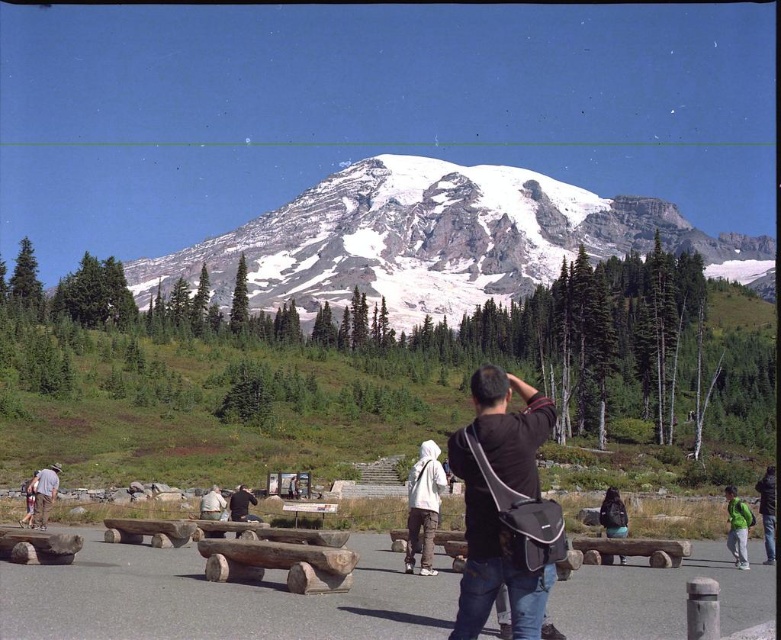
You are planning to borrow a jacket from either the green fabric jacket at lower right or the denim jacket at lower left. Which jacket should you choose if you want the wider one?

The green fabric jacket at lower right is wider than the denim jacket at lower left, so you should choose the green fabric jacket at lower right.